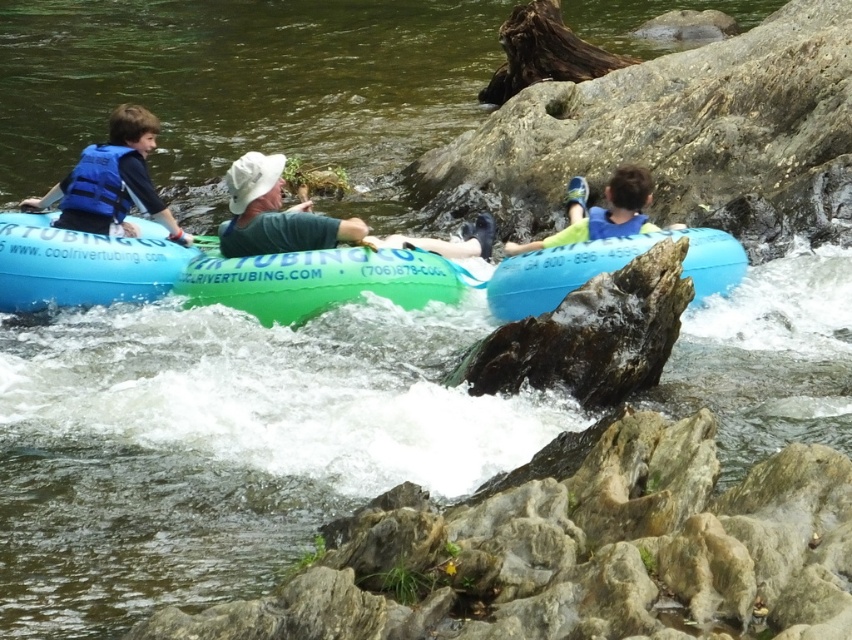
Between point (550, 276) and point (625, 189), which one is positioned in front?

Point (550, 276)

Is blue rubber tube at center in front of light blue rubber tube at center?

Yes.

This screenshot has height=640, width=852. I want to click on blue rubber tube at center, so click(x=607, y=269).

Is green rubber raft at center to the right of matte blue tube at left from the viewer's perspective?

Indeed, green rubber raft at center is positioned on the right side of matte blue tube at left.

Does green rubber raft at center have a lesser width compared to matte blue tube at left?

Incorrect, green rubber raft at center's width is not less than matte blue tube at left's.

Between point (380, 292) and point (55, 268), which one is positioned in front?

Point (55, 268) is more forward.

This screenshot has height=640, width=852. Find the location of `green rubber raft at center`. green rubber raft at center is located at coordinates (320, 280).

Which is behind, point (15, 300) or point (623, 209)?

The point (623, 209) is behind.

Is point (78, 300) closer to camera compared to point (613, 193)?

Yes, it is.

Locate an element on the screen. matte blue tube at left is located at coordinates (82, 262).